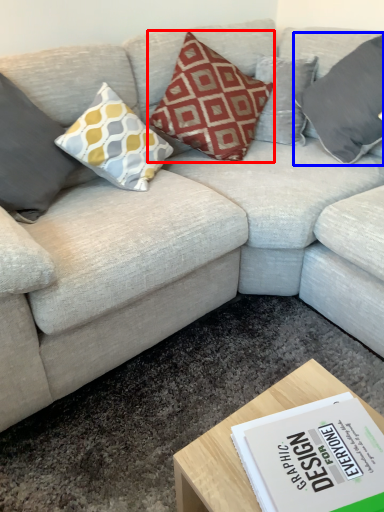
Question: Which point is closer to the camera, pillow (highlighted by a red box) or pillow (highlighted by a blue box)?

Choices:
 (A) pillow
 (B) pillow

Answer: (A)